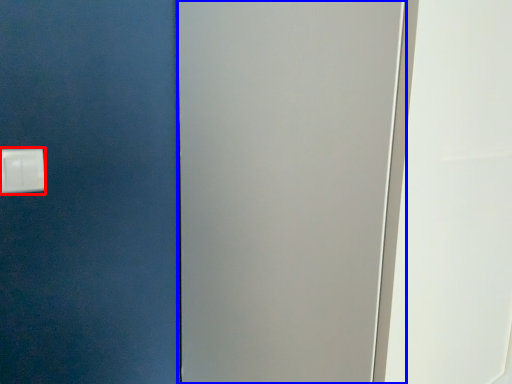
Question: Which object appears closest to the camera in this image, light switch (highlighted by a red box) or screen door (highlighted by a blue box)?

Choices:
 (A) light switch
 (B) screen door

Answer: (B)